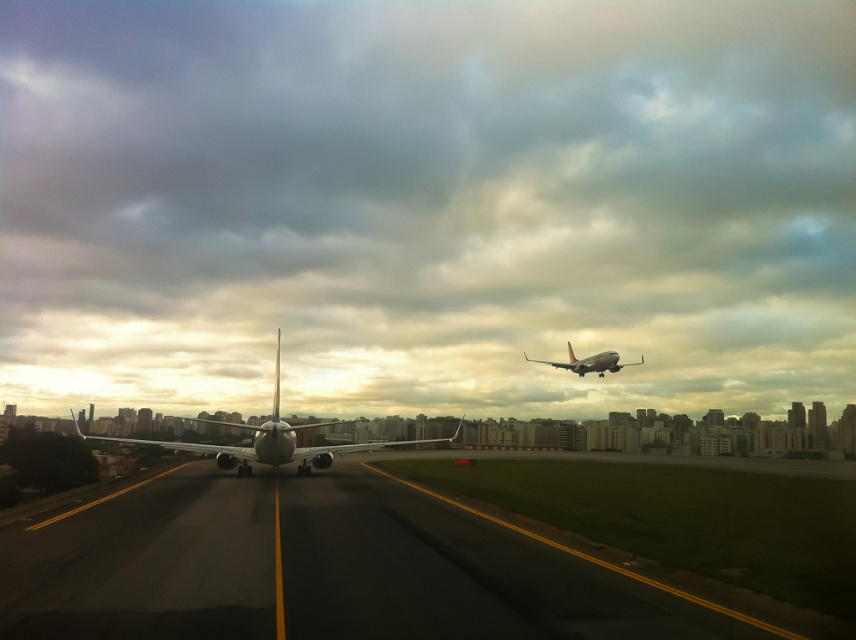
You are a pilot preparing to land your plane on the runway. You notice the black asphalt tarmac at center and the metallic silver airplane at upper right. Which object is positioned lower in the image?

The black asphalt tarmac at center is located below the metallic silver airplane at upper right, so it is positioned lower in the image.